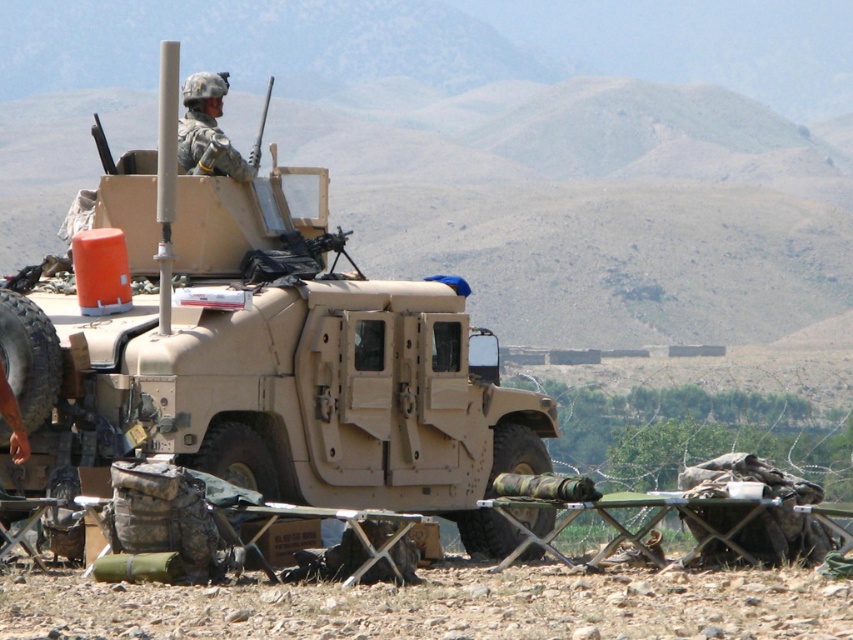
Question: Does tan matte military vehicle at center lie behind camouflage helmet at upper center?

Choices:
 (A) no
 (B) yes

Answer: (B)

Question: Is tan matte military vehicle at center smaller than camouflage helmet at upper center?

Choices:
 (A) no
 (B) yes

Answer: (B)

Question: Which point is closer to the camera?

Choices:
 (A) (252, 157)
 (B) (33, 492)

Answer: (B)

Question: Which point appears closest to the camera in this image?

Choices:
 (A) click(274, 390)
 (B) click(219, 132)

Answer: (A)

Question: Is tan matte military vehicle at center below camouflage helmet at upper center?

Choices:
 (A) yes
 (B) no

Answer: (A)